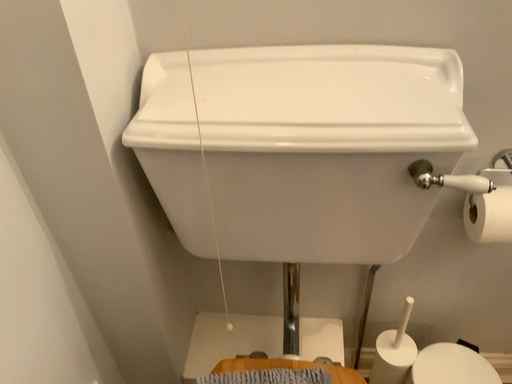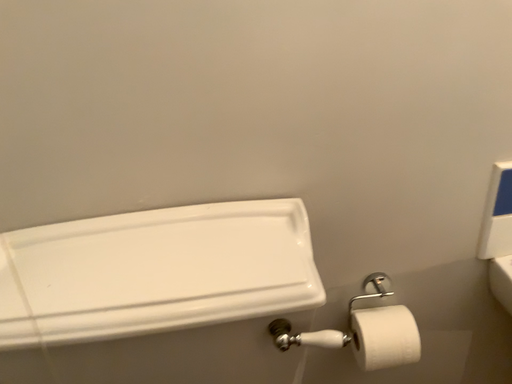
Question: How did the camera likely rotate when shooting the video?

Choices:
 (A) rotated right
 (B) rotated left

Answer: (A)